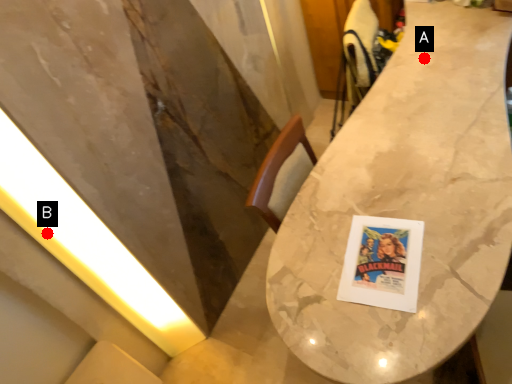
Question: Two points are circled on the image, labeled by A and B beside each circle. Among these points, which one is nearest to the camera?

Choices:
 (A) A is closer
 (B) B is closer

Answer: (B)